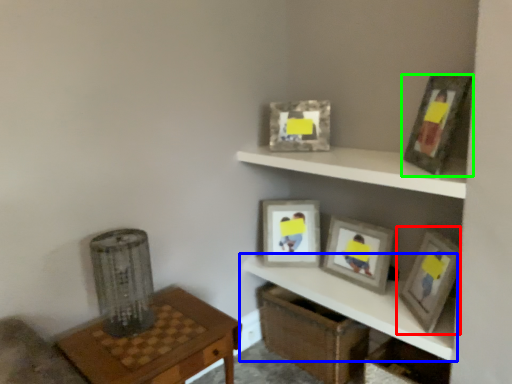
Question: Based on their relative distances, which object is nearer to picture frame (highlighted by a red box)? Choose from shelf (highlighted by a blue box) and picture frame (highlighted by a green box).

Choices:
 (A) shelf
 (B) picture frame

Answer: (A)